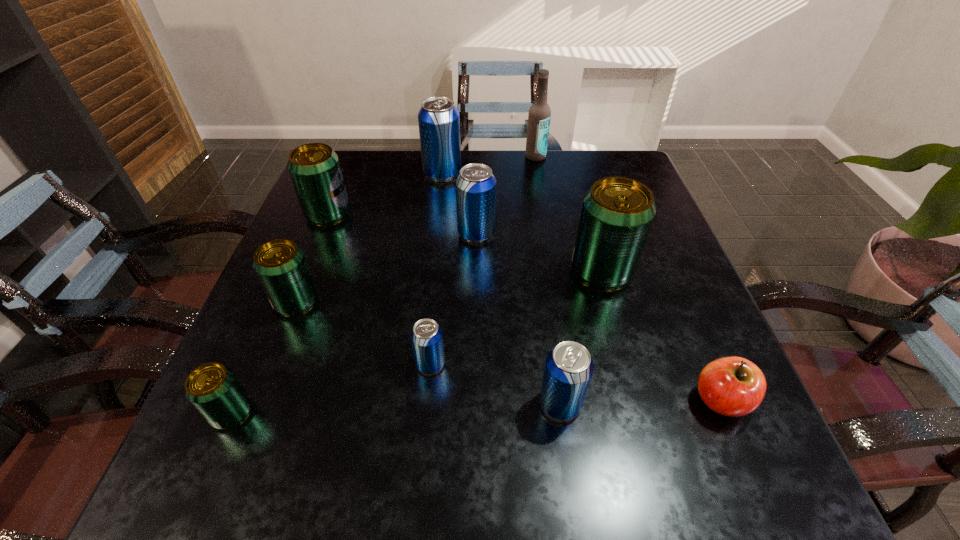
The height and width of the screenshot is (540, 960). I want to click on vacant space that is in between the second farthest blue beer can and the tallest object, so click(506, 195).

What are the coordinates of `free space between the farthest green beer can and the second farthest blue beer can` in the screenshot? It's located at (402, 224).

This screenshot has width=960, height=540. Find the location of `vacant space that's between the third smallest blue beer can and the third biggest green beer can`. vacant space that's between the third smallest blue beer can and the third biggest green beer can is located at coordinates (387, 267).

The width and height of the screenshot is (960, 540). In order to click on vacant region between the seventh farthest object and the second smallest green beer can in this screenshot , I will do `click(364, 333)`.

Locate an element on the screen. vacant point located between the tallest object and the smallest blue beer can is located at coordinates [x=483, y=260].

Identify which object is the second closest to the beer bottle. Please provide its 2D coordinates. Your answer should be formatted as a tuple, i.e. [(x, y)], where the tuple contains the x and y coordinates of a point satisfying the conditions above.

[(475, 185)]

Identify which object is located as the seventh nearest to the second smallest blue beer can. Please provide its 2D coordinates. Your answer should be formatted as a tuple, i.e. [(x, y)], where the tuple contains the x and y coordinates of a point satisfying the conditions above.

[(314, 168)]

What are the coordinates of `beer can that stands as the closest to the biggest blue beer can` in the screenshot? It's located at (475, 185).

Locate which beer can ranks in proximity to the farthest green beer can. Please provide its 2D coordinates. Your answer should be formatted as a tuple, i.e. [(x, y)], where the tuple contains the x and y coordinates of a point satisfying the conditions above.

[(438, 119)]

Point out which blue beer can is positioned as the second nearest to the rightmost object. Please provide its 2D coordinates. Your answer should be formatted as a tuple, i.e. [(x, y)], where the tuple contains the x and y coordinates of a point satisfying the conditions above.

[(426, 335)]